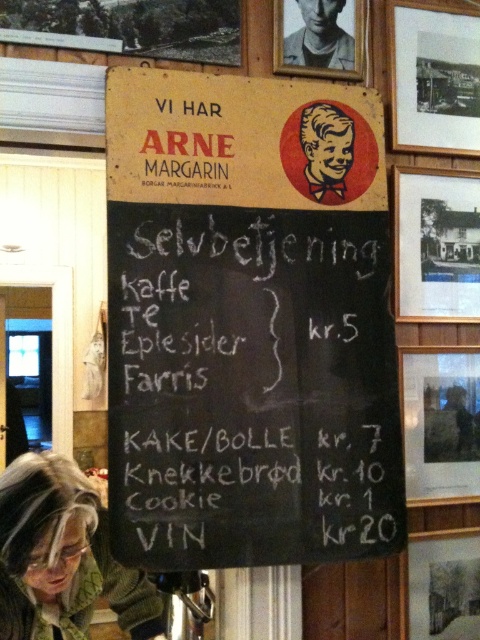
Where is `wooden framed photo at upper right`? wooden framed photo at upper right is located at coordinates (433, 80).

Does wooden framed photo at upper right have a lesser height compared to red paper boy at upper center?

No, wooden framed photo at upper right is not shorter than red paper boy at upper center.

The image size is (480, 640). In order to click on wooden framed photo at upper right in this screenshot , I will do `click(433, 80)`.

Is wooden framed photo at upper right positioned in front of wooden frame at upper right?

No, it is not.

Which is above, wooden framed photo at upper right or wooden frame at upper right?

Positioned higher is wooden framed photo at upper right.

Is point (471, 97) less distant than point (420, 388)?

That is False.

What are the coordinates of `wooden framed photo at upper right` in the screenshot? It's located at (433, 80).

Can you confirm if wooden frame at upper right is smaller than red paper boy at upper center?

No.

Is point (446, 360) positioned before point (311, 131)?

No, it is behind (311, 131).

The width and height of the screenshot is (480, 640). Describe the element at coordinates (441, 424) in the screenshot. I see `wooden frame at upper right` at that location.

Find the location of a particular element. wooden frame at upper right is located at coordinates [x=441, y=424].